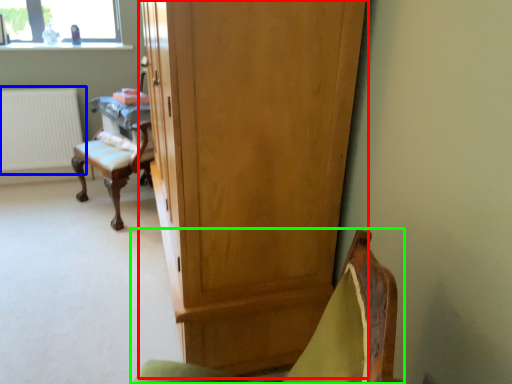
Question: Which object is the farthest from cupboard (highlighted by a red box)? Choose among these: radiator (highlighted by a blue box) or chair (highlighted by a green box).

Choices:
 (A) radiator
 (B) chair

Answer: (A)